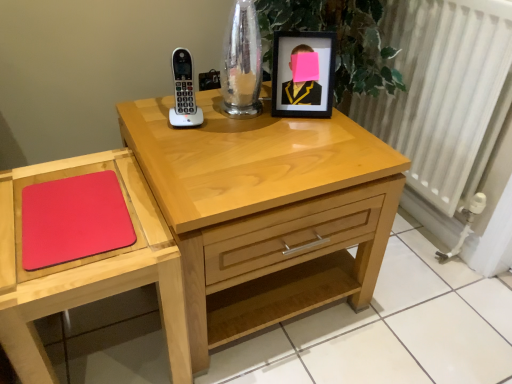
Where is `empty space that is ontop of matte wooden mouse pad at lower left (from a real-world perspective)`? empty space that is ontop of matte wooden mouse pad at lower left (from a real-world perspective) is located at coordinates (76, 205).